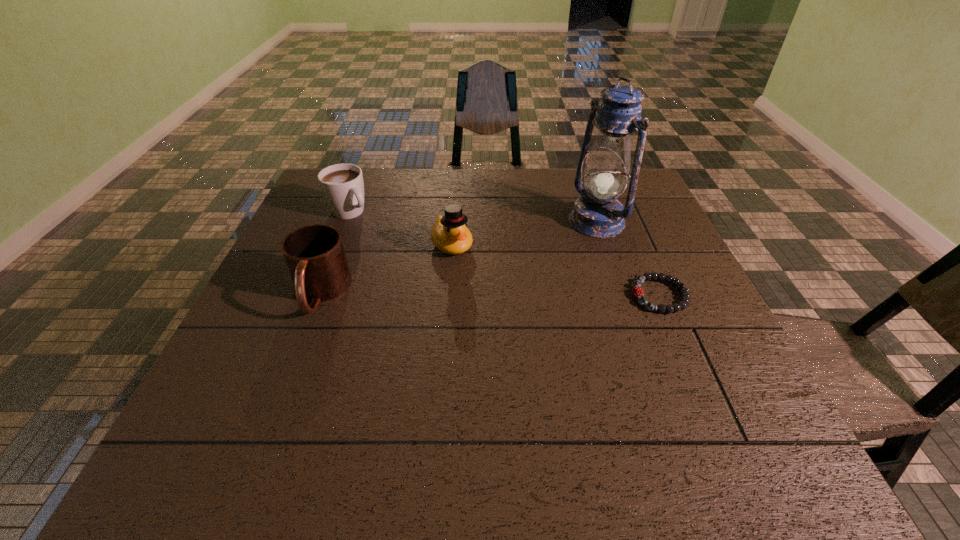
Identify the location of free area in between the mug and the shortest object. The width and height of the screenshot is (960, 540). (491, 294).

I want to click on blank region between the third object from right to left and the shortest object, so click(x=556, y=270).

This screenshot has height=540, width=960. I want to click on empty location between the tallest object and the bracelet, so click(x=628, y=258).

Where is `empty location between the third object from right to left and the mug`? The width and height of the screenshot is (960, 540). empty location between the third object from right to left and the mug is located at coordinates (386, 269).

The image size is (960, 540). What are the coordinates of `free space between the tallest object and the shortest object` in the screenshot? It's located at (628, 258).

Locate an element on the screen. Image resolution: width=960 pixels, height=540 pixels. free spot between the shortest object and the mug is located at coordinates (491, 294).

Identify the location of vacant point located between the bracelet and the third object from left to right. (556, 270).

Where is `free space that is in between the cappuccino and the duck`? This screenshot has width=960, height=540. free space that is in between the cappuccino and the duck is located at coordinates (400, 228).

This screenshot has width=960, height=540. I want to click on object that is the fourth closest one to the bracelet, so click(342, 185).

Identify which object is located as the nearest to the cappuccino. Please provide its 2D coordinates. Your answer should be formatted as a tuple, i.e. [(x, y)], where the tuple contains the x and y coordinates of a point satisfying the conditions above.

[(315, 256)]